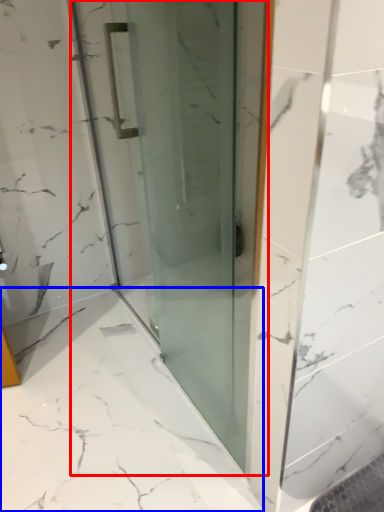
Question: Which object appears closest to the camera in this image, door (highlighted by a red box) or bath (highlighted by a blue box)?

Choices:
 (A) door
 (B) bath

Answer: (A)